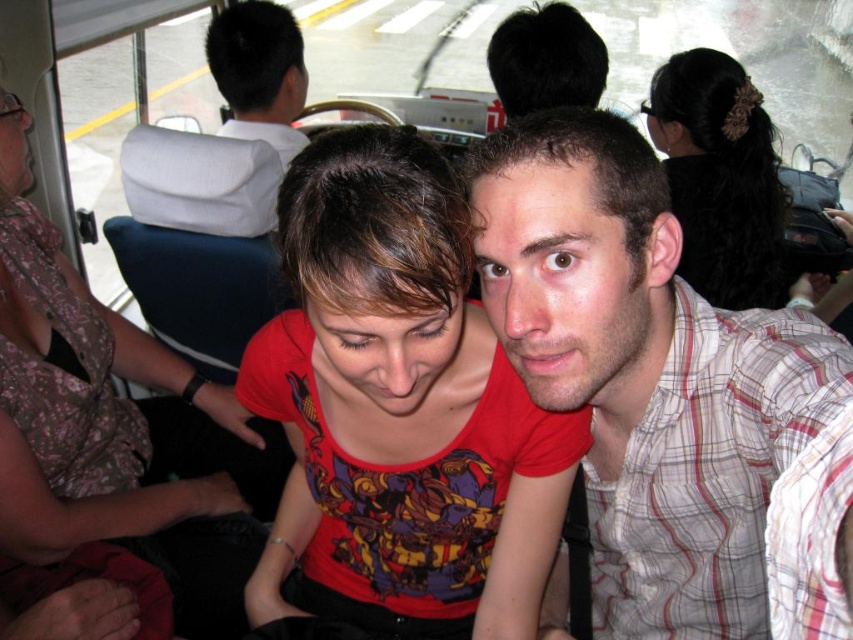
Is matte red t-shirt at center to the right of white shirt at upper center from the viewer's perspective?

Indeed, matte red t-shirt at center is positioned on the right side of white shirt at upper center.

Can you confirm if matte red t-shirt at center is positioned below white shirt at upper center?

Yes, matte red t-shirt at center is below white shirt at upper center.

Find the location of `matte red t-shirt at center`. matte red t-shirt at center is located at coordinates (399, 404).

Between matte red shirt at center and dark brown hair at upper right, which one has less height?

dark brown hair at upper right

You are a GUI agent. You are given a task and a screenshot of the screen. Output one action in this format:
    pyautogui.click(x=<x>, y=<y>)
    Task: Click on the matte red shirt at center
    
    Given the screenshot: What is the action you would take?
    pyautogui.click(x=111, y=426)

The image size is (853, 640). In order to click on plaid cotton shirt at center in this screenshot , I will do `click(646, 372)`.

Is plaid cotton shirt at center wider than white shirt at upper center?

Yes.

This screenshot has width=853, height=640. What are the coordinates of `plaid cotton shirt at center` in the screenshot? It's located at point(646,372).

I want to click on plaid cotton shirt at center, so click(x=646, y=372).